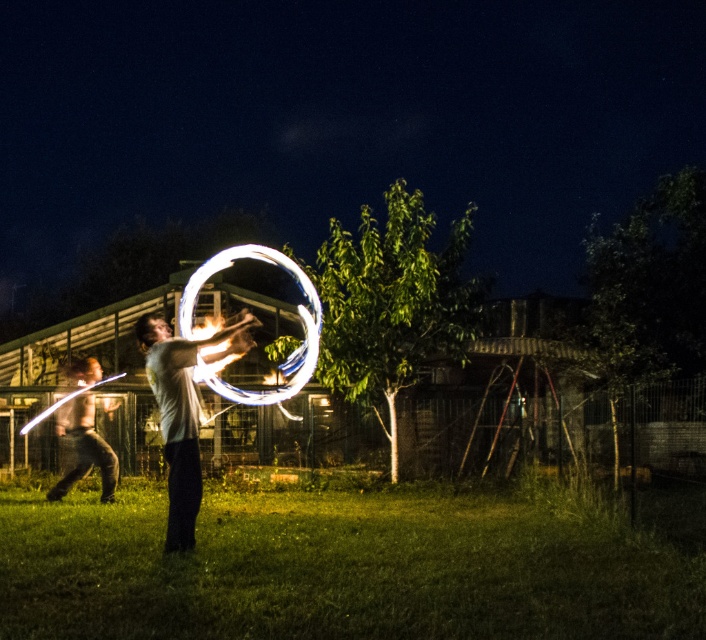
You are a photographer trying to capture the motion of the two people in the image. You notice the white glossy hula hoop at center and the matte white shirt at center. Which object is positioned to the right of the other?

The white glossy hula hoop at center is to the right of the matte white shirt at center.

You are standing in the nighttime scene and want to reach the two glowing points. Which point, point (x=186, y=545) or point (x=301, y=380), is closer to you?

Point (x=186, y=545) is closer to the viewer than point (x=301, y=380).

You are a photographer trying to capture the glowing objects in the scene. Which object, the green grass at center or the white glowing ring at center, would appear larger in your photo?

The white glowing ring at center would appear larger in the photo because the green grass at center has a smaller size compared to it.